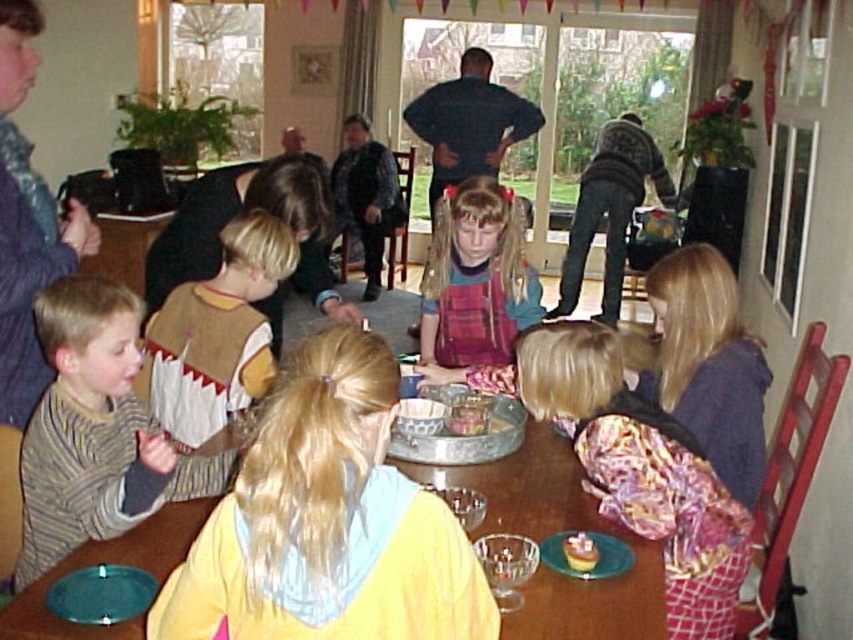
Is floral fabric dress at lower right to the right of striped cotton shirt at lower left from the viewer's perspective?

Yes, floral fabric dress at lower right is to the right of striped cotton shirt at lower left.

Is point (643, 509) closer to viewer compared to point (67, 296)?

No, it is behind (67, 296).

Where is `floral fabric dress at lower right`? The width and height of the screenshot is (853, 640). floral fabric dress at lower right is located at coordinates (640, 470).

Who is positioned more to the left, wooden table at center or dark blue shirt at upper center?

Positioned to the left is dark blue shirt at upper center.

Does wooden table at center have a lesser height compared to dark blue shirt at upper center?

Correct, wooden table at center is not as tall as dark blue shirt at upper center.

Is point (80, 637) behind point (502, 93)?

No, it is not.

Where is `wooden table at center`? wooden table at center is located at coordinates (550, 532).

Locate an element on the screen. Image resolution: width=853 pixels, height=640 pixels. plaid fabric dress at center is located at coordinates (476, 276).

Can you confirm if plaid fabric dress at center is positioned above dark blue shirt at upper center?

No, plaid fabric dress at center is not above dark blue shirt at upper center.

Is point (459, 355) farther from viewer compared to point (462, 72)?

No, it is in front of (462, 72).

Identify the location of plaid fabric dress at center. (476, 276).